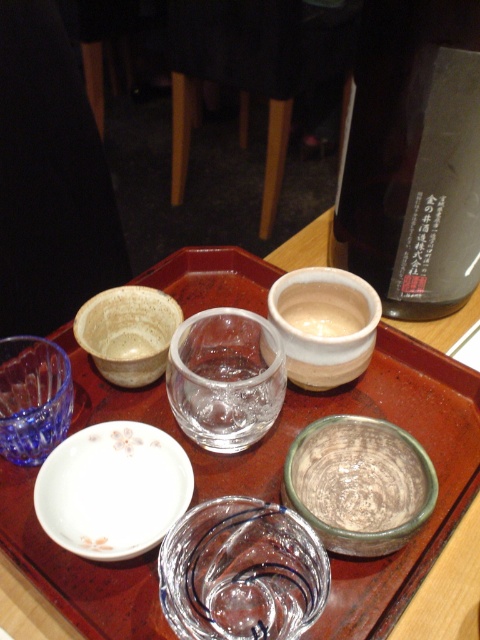
Question: Does white porcelain plate at center have a greater width compared to green glazed bowl at lower center?

Choices:
 (A) no
 (B) yes

Answer: (B)

Question: Which point is farther to the camera?

Choices:
 (A) white porcelain plate at center
 (B) transparent glass bowl at center
 (C) transparent glass cup at center
 (D) green glazed bowl at lower center

Answer: (C)

Question: Among these objects, which one is farthest from the camera?

Choices:
 (A) white stoneware bowl at center
 (B) matte ceramic bowl at upper left
 (C) blue glass bowl at lower left

Answer: (B)

Question: Estimate the real-world distances between objects in this image. Which object is farther from the transparent glass cup at center?

Choices:
 (A) transparent glass bowl at center
 (B) matte ceramic bowl at upper left
 (C) transparent glass tray at center
 (D) white stoneware bowl at center

Answer: (A)

Question: Can you confirm if transparent glass tray at center is thinner than transparent glass cup at center?

Choices:
 (A) yes
 (B) no

Answer: (B)

Question: Is transparent glass tray at center further to camera compared to matte ceramic bowl at upper left?

Choices:
 (A) yes
 (B) no

Answer: (B)